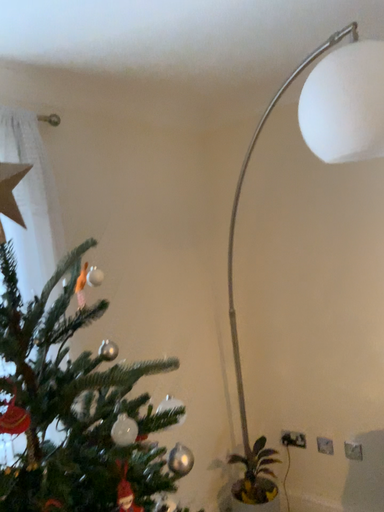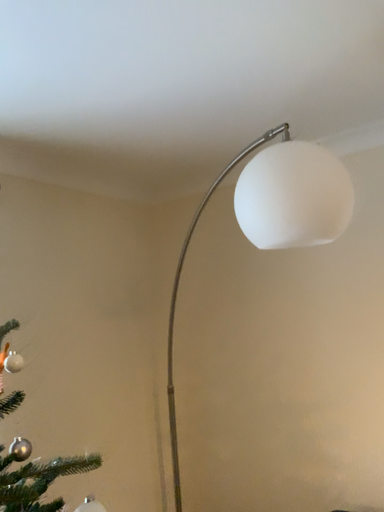
Question: Which way did the camera rotate in the video?

Choices:
 (A) rotated right
 (B) rotated left

Answer: (A)